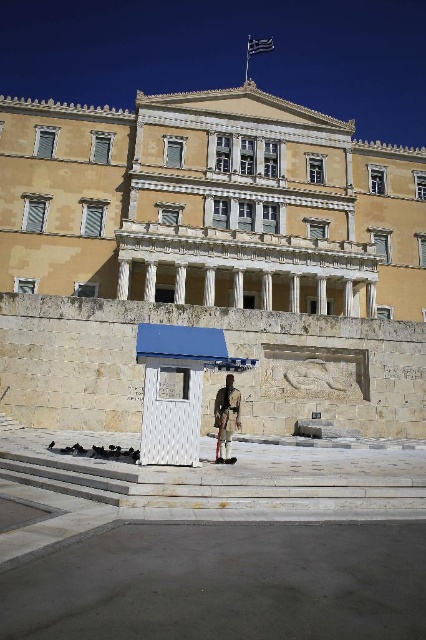
Question: Is yellow stone building at center above white plastic bus stop at center?

Choices:
 (A) yes
 (B) no

Answer: (A)

Question: Which point is farther from the camera taking this photo?

Choices:
 (A) (417, 163)
 (B) (166, 404)

Answer: (A)

Question: Which object appears closest to the camera in this image?

Choices:
 (A) yellow stone building at center
 (B) white plastic bus stop at center
 (C) white uniform at center

Answer: (B)

Question: Which of these objects is positioned closest to the yellow stone building at center?

Choices:
 (A) white uniform at center
 (B) white plastic bus stop at center

Answer: (B)

Question: Is the position of yellow stone building at center less distant than that of white plastic bus stop at center?

Choices:
 (A) yes
 (B) no

Answer: (B)

Question: Does yellow stone building at center have a larger size compared to white uniform at center?

Choices:
 (A) yes
 (B) no

Answer: (A)